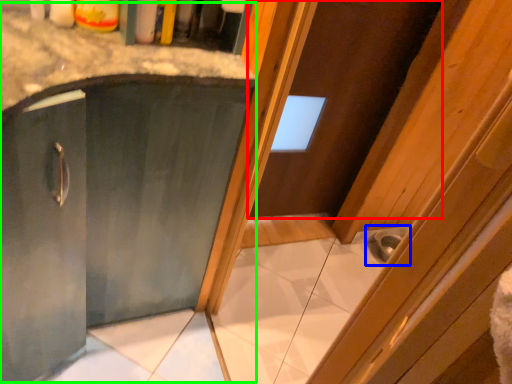
Question: Considering the real-world distances, which object is farthest from door (highlighted by a red box)? sink (highlighted by a blue box) or cabinetry (highlighted by a green box)?

Choices:
 (A) sink
 (B) cabinetry

Answer: (B)